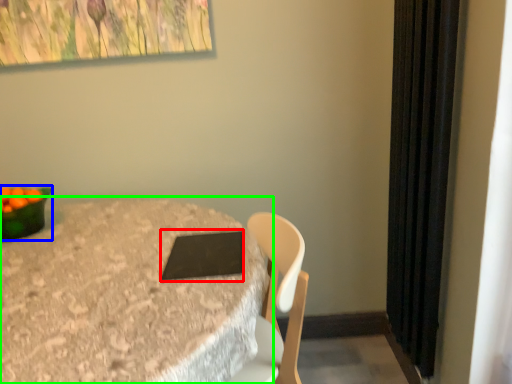
Question: Considering the real-world distances, which object is farthest from pad (highlighted by a red box)? bowl (highlighted by a blue box) or table (highlighted by a green box)?

Choices:
 (A) bowl
 (B) table

Answer: (A)